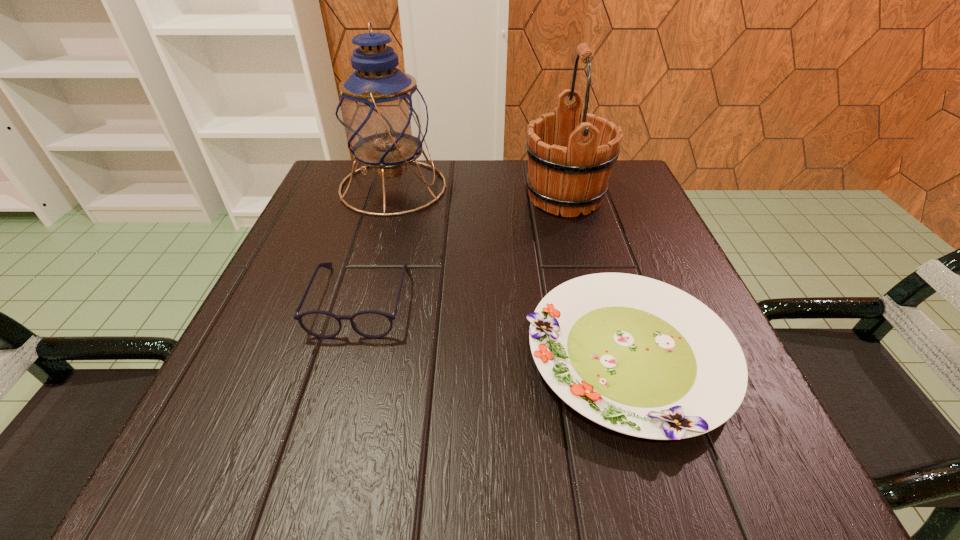
In order to click on vacant area in the image that satisfies the following two spatial constraints: 1. on the front-facing side of the lantern; 2. on the right side of the salad plate in this screenshot , I will do `click(346, 357)`.

This screenshot has width=960, height=540. Identify the location of free spot that satisfies the following two spatial constraints: 1. on the back side of the wine bucket; 2. on the front-facing side of the lantern. (562, 187).

I want to click on free space that satisfies the following two spatial constraints: 1. on the front-facing side of the shortest object; 2. on the right side of the lantern, so click(346, 357).

Where is `vacant position in the image that satisfies the following two spatial constraints: 1. on the front side of the shortest object; 2. on the left side of the wine bucket`? This screenshot has width=960, height=540. vacant position in the image that satisfies the following two spatial constraints: 1. on the front side of the shortest object; 2. on the left side of the wine bucket is located at coordinates (607, 357).

Locate an element on the screen. The height and width of the screenshot is (540, 960). free location that satisfies the following two spatial constraints: 1. on the front-facing side of the lantern; 2. on the front-facing side of the second shortest object is located at coordinates (361, 300).